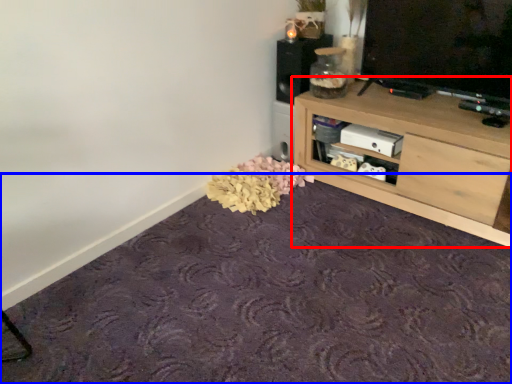
Question: Which object is further to the camera taking this photo, shelf (highlighted by a red box) or plain (highlighted by a blue box)?

Choices:
 (A) shelf
 (B) plain

Answer: (A)